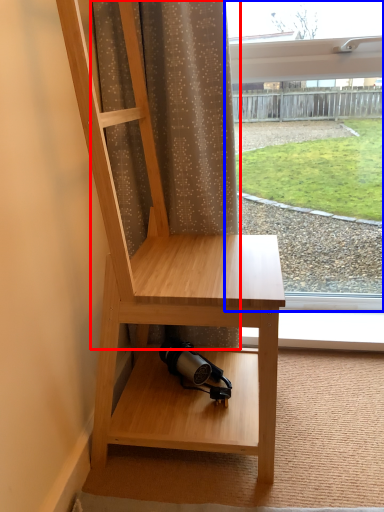
Question: Which point is further to the camera, curtain (highlighted by a red box) or window (highlighted by a blue box)?

Choices:
 (A) curtain
 (B) window

Answer: (B)